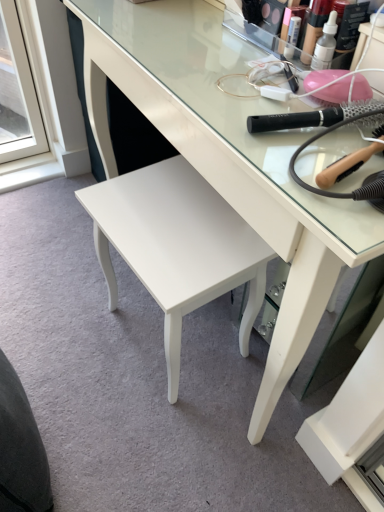
Identify the location of vacant space to the left of black plastic hairbrush at upper right, which is counted as the first brush, starting from the top. (231, 109).